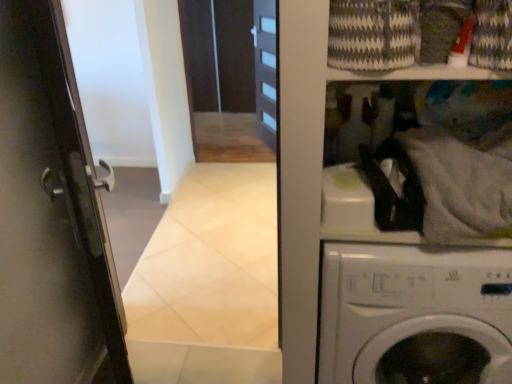
I want to click on knitted wool laundry basket at upper right, so click(417, 33).

What do you see at coordinates (417, 33) in the screenshot? I see `knitted wool laundry basket at upper right` at bounding box center [417, 33].

What do you see at coordinates (415, 315) in the screenshot? I see `white matte washing machine at upper right` at bounding box center [415, 315].

What are the coordinates of `white matte washing machine at upper right` in the screenshot? It's located at (415, 315).

Locate an element on the screen. This screenshot has width=512, height=384. knitted wool laundry basket at upper right is located at coordinates (417, 33).

Based on their positions, is white matte washing machine at upper right located to the left or right of knitted wool laundry basket at upper right?

Clearly, white matte washing machine at upper right is on the right of knitted wool laundry basket at upper right in the image.

Which object is closer to the camera, white matte washing machine at upper right or knitted wool laundry basket at upper right?

knitted wool laundry basket at upper right is in front.

Which is farther from the camera, (321, 380) or (488, 7)?

Positioned behind is point (321, 380).

From the image's perspective, is white matte washing machine at upper right below knitted wool laundry basket at upper right?

Correct, white matte washing machine at upper right appears lower than knitted wool laundry basket at upper right in the image.

From a real-world perspective, which object stands above the other?

knitted wool laundry basket at upper right, from a real-world perspective.

Does white matte washing machine at upper right have a greater width compared to knitted wool laundry basket at upper right?

Correct, the width of white matte washing machine at upper right exceeds that of knitted wool laundry basket at upper right.

Who is taller, white matte washing machine at upper right or knitted wool laundry basket at upper right?

With more height is white matte washing machine at upper right.

Can you confirm if white matte washing machine at upper right is smaller than knitted wool laundry basket at upper right?

Actually, white matte washing machine at upper right might be larger than knitted wool laundry basket at upper right.

Can we say white matte washing machine at upper right lies outside knitted wool laundry basket at upper right?

That's correct, white matte washing machine at upper right is outside of knitted wool laundry basket at upper right.

Are white matte washing machine at upper right and knitted wool laundry basket at upper right making contact?

No.

Is white matte washing machine at upper right aimed at knitted wool laundry basket at upper right?

No, white matte washing machine at upper right is not turned towards knitted wool laundry basket at upper right.

Consider the image. How many degrees apart are the facing directions of white matte washing machine at upper right and knitted wool laundry basket at upper right?

The facing directions of white matte washing machine at upper right and knitted wool laundry basket at upper right are 0.598 degrees apart.

At what (x,y) coordinates should I click in order to perform the action: click on washing machine below the knitted wool laundry basket at upper right (from the image's perspective). Please return your answer as a coordinate pair (x, y). This screenshot has width=512, height=384. Looking at the image, I should click on (415, 315).

Is knitted wool laundry basket at upper right at the left side of white matte washing machine at upper right?

Yes.

Which object is closer to the camera taking this photo, knitted wool laundry basket at upper right or white matte washing machine at upper right?

knitted wool laundry basket at upper right is more forward.

Which is less distant, (355, 29) or (320, 382)?

Clearly, point (355, 29) is closer to the camera than point (320, 382).

From the image's perspective, between knitted wool laundry basket at upper right and white matte washing machine at upper right, which one is located above?

From the image's view, knitted wool laundry basket at upper right is above.

From a real-world perspective, which is physically above, knitted wool laundry basket at upper right or white matte washing machine at upper right?

knitted wool laundry basket at upper right.

Is knitted wool laundry basket at upper right thinner than white matte washing machine at upper right?

Correct, the width of knitted wool laundry basket at upper right is less than that of white matte washing machine at upper right.

Who is shorter, knitted wool laundry basket at upper right or white matte washing machine at upper right?

knitted wool laundry basket at upper right.

Who is smaller, knitted wool laundry basket at upper right or white matte washing machine at upper right?

knitted wool laundry basket at upper right.

From the picture: Is white matte washing machine at upper right located within knitted wool laundry basket at upper right?

No.

Is there a large distance between knitted wool laundry basket at upper right and white matte washing machine at upper right?

No.

Is knitted wool laundry basket at upper right facing towards white matte washing machine at upper right?

No, knitted wool laundry basket at upper right does not turn towards white matte washing machine at upper right.

The width and height of the screenshot is (512, 384). In the image, there is a knitted wool laundry basket at upper right. Find the location of `washing machine below it (from the image's perspective)`. washing machine below it (from the image's perspective) is located at coordinates (415, 315).

This screenshot has width=512, height=384. What are the coordinates of `laundry on the left of white matte washing machine at upper right` in the screenshot? It's located at coord(417,33).

This screenshot has height=384, width=512. I want to click on washing machine below the knitted wool laundry basket at upper right (from the image's perspective), so click(x=415, y=315).